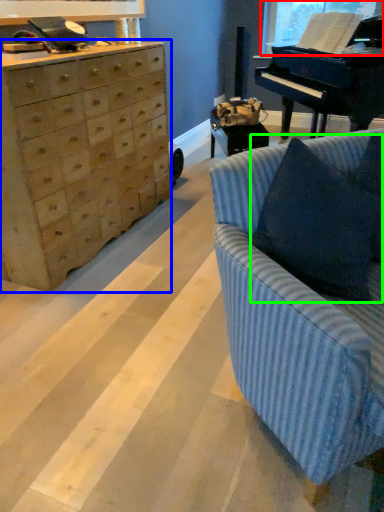
Question: Which object is the closest to the window screen (highlighted by a red box)? Choose among these: chest of drawers (highlighted by a blue box) or pillow (highlighted by a green box).

Choices:
 (A) chest of drawers
 (B) pillow

Answer: (A)